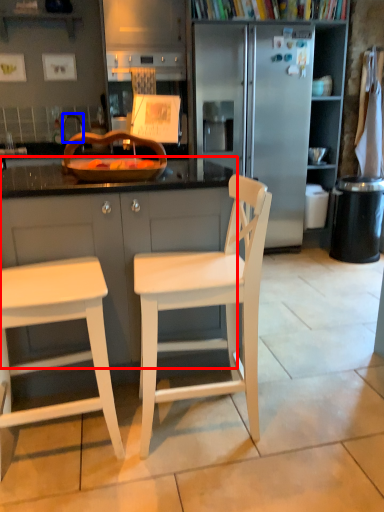
Question: Among these objects, which one is nearest to the camera, cabinetry (highlighted by a red box) or faucet (highlighted by a blue box)?

Choices:
 (A) cabinetry
 (B) faucet

Answer: (A)